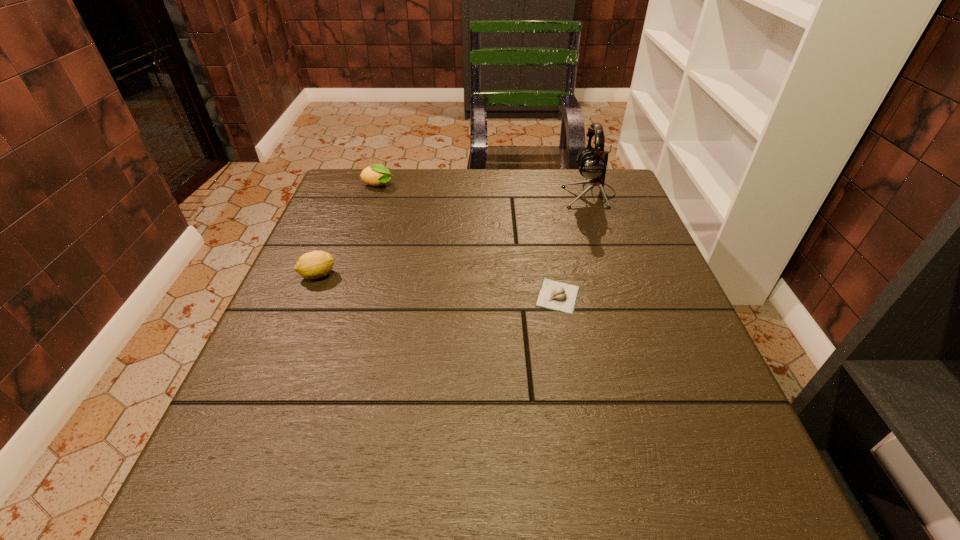
You are a GUI agent. You are given a task and a screenshot of the screen. Output one action in this format:
    pyautogui.click(x=<x>, y=<y>)
    Task: Click on the earphone
    The width and height of the screenshot is (960, 540).
    Given the screenshot: What is the action you would take?
    pyautogui.click(x=592, y=163)

This screenshot has height=540, width=960. What are the coordinates of `the tallest object` in the screenshot? It's located at (592, 163).

This screenshot has width=960, height=540. Find the location of `the farther lemon`. the farther lemon is located at coordinates (376, 175).

I want to click on the nearer lemon, so click(x=316, y=264).

This screenshot has height=540, width=960. What are the coordinates of `the second object from right to left` in the screenshot? It's located at (559, 296).

I want to click on garlic, so (x=559, y=296).

The width and height of the screenshot is (960, 540). Find the location of `free space located 0.090m on the front of the rightmost object`. free space located 0.090m on the front of the rightmost object is located at coordinates (602, 228).

You are a GUI agent. You are given a task and a screenshot of the screen. Output one action in this format:
    pyautogui.click(x=<x>, y=<y>)
    Task: Click on the vacant point located with leaves positioned above the farther lemon
    The width and height of the screenshot is (960, 540).
    Given the screenshot: What is the action you would take?
    (x=426, y=186)

The height and width of the screenshot is (540, 960). In order to click on vacant space positioned at the stem end of the nearer lemon in this screenshot , I will do `click(499, 275)`.

This screenshot has width=960, height=540. Identify the location of free space located on the left of the garlic. (501, 296).